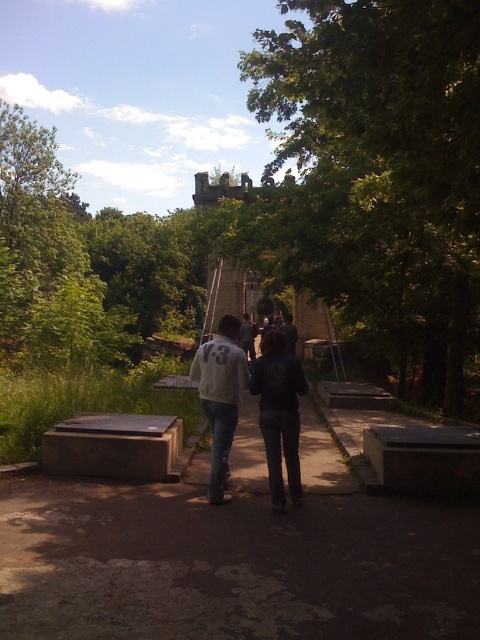
Question: Which object is farther from the camera taking this photo?

Choices:
 (A) dark gray hoodie at center
 (B) dark blue jeans at center
 (C) white matte jacket at center
 (D) white cotton jacket at center

Answer: (C)

Question: Does green leafy tree at upper center appear under dark blue jeans at center?

Choices:
 (A) yes
 (B) no

Answer: (B)

Question: Can you confirm if dark blue jeans at center is positioned above light gray sweater at center?

Choices:
 (A) yes
 (B) no

Answer: (B)

Question: Among these objects, which one is nearest to the camera?

Choices:
 (A) dark blue jeans at center
 (B) dark gray hoodie at center
 (C) green leafy tree at upper center
 (D) light gray sweater at center

Answer: (C)

Question: Estimate the real-world distances between objects in this image. Which object is closer to the dark gray hoodie at center?

Choices:
 (A) green leafy tree at upper center
 (B) white cotton jacket at center
 (C) light gray sweater at center
 (D) dark blue jeans at center

Answer: (C)

Question: Is white cotton jacket at center to the right of white matte jacket at center from the viewer's perspective?

Choices:
 (A) no
 (B) yes

Answer: (A)